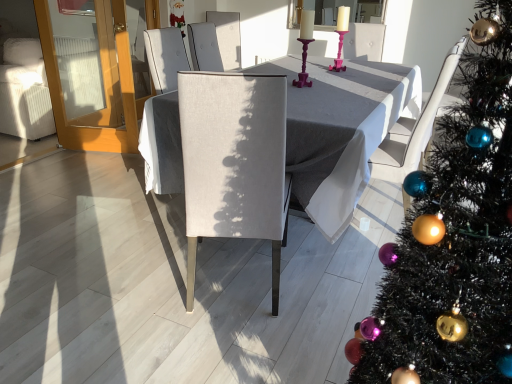
Describe the element at coordinates (339, 54) in the screenshot. This screenshot has width=512, height=384. I see `pink plastic candle holder at center` at that location.

At what (x,y) coordinates should I click in order to perform the action: click on shiny green christmas tree at right. Please return your answer as a coordinate pair (x, y). The image size is (512, 384). Looking at the image, I should click on (456, 238).

Image resolution: width=512 pixels, height=384 pixels. What do you see at coordinates (337, 11) in the screenshot?
I see `matte glass candlesticks at upper center` at bounding box center [337, 11].

Where is `matte glass candlesticks at upper center`? The height and width of the screenshot is (384, 512). matte glass candlesticks at upper center is located at coordinates (337, 11).

What do you see at coordinates (413, 129) in the screenshot?
I see `white fabric armchair at right` at bounding box center [413, 129].

Find the location of a particular element. This screenshot has height=384, width=512. pink plastic candle holder at center is located at coordinates (339, 54).

Is white fabric armchair at right touching matte glass candlesticks at upper center?

No, white fabric armchair at right is not touching matte glass candlesticks at upper center.

From a real-world perspective, is white fabric armchair at right under matte glass candlesticks at upper center?

Yes, from a real-world perspective, white fabric armchair at right is beneath matte glass candlesticks at upper center.

Which object is further away from the camera taking this photo, white fabric armchair at right or matte glass candlesticks at upper center?

Positioned behind is matte glass candlesticks at upper center.

Are pink plastic candle holder at center and matte gray table at center located far from each other?

No.

The image size is (512, 384). I want to click on candle holder behind the matte gray table at center, so click(339, 54).

Considering the sizes of objects pink plastic candle holder at center and matte gray table at center in the image provided, who is bigger, pink plastic candle holder at center or matte gray table at center?

Bigger between the two is matte gray table at center.

Is pink plastic candle holder at center in front of or behind matte gray table at center in the image?

pink plastic candle holder at center is behind matte gray table at center.

Is matte gray chair at center smaller than matte glass candlesticks at upper center?

Incorrect, matte gray chair at center is not smaller in size than matte glass candlesticks at upper center.

From the picture: From a real-world perspective, which object rests below the other?

From a 3D spatial view, matte gray chair at center is below.

Does point (211, 229) appear closer or farther from the camera than point (372, 3)?

Point (211, 229) appears to be closer to the viewer than point (372, 3).

Is matte gray chair at center facing away from matte glass candlesticks at upper center?

That's not correct — matte gray chair at center is not looking away from matte glass candlesticks at upper center.

From the image's perspective, between shiny green christmas tree at right and matte glass candlesticks at upper center, who is located below?

From the image's view, shiny green christmas tree at right is below.

Is shiny green christmas tree at right further to the viewer compared to matte glass candlesticks at upper center?

No, shiny green christmas tree at right is in front of matte glass candlesticks at upper center.

Considering the sizes of shiny green christmas tree at right and matte glass candlesticks at upper center in the image, is shiny green christmas tree at right bigger or smaller than matte glass candlesticks at upper center?

shiny green christmas tree at right is bigger than matte glass candlesticks at upper center.

Is shiny green christmas tree at right facing towards matte glass candlesticks at upper center?

No, shiny green christmas tree at right is not facing towards matte glass candlesticks at upper center.

Is pink plastic candle holder at center taller than matte gray chair at center?

Incorrect, the height of pink plastic candle holder at center is not larger of that of matte gray chair at center.

From the picture: Could you tell me if pink plastic candle holder at center is turned towards matte gray chair at center?

No.

Is pink plastic candle holder at center positioned far away from matte gray chair at center?

Yes, pink plastic candle holder at center and matte gray chair at center are located far from each other.

Is pink plastic candle holder at center to the left or to the right of matte gray chair at center in the image?

pink plastic candle holder at center is positioned on matte gray chair at center's right side.

Is shiny green christmas tree at right positioned far away from matte gray table at center?

shiny green christmas tree at right is far away from matte gray table at center.

What's the angular difference between shiny green christmas tree at right and matte gray table at center's facing directions?

There is a 0.0419-degree angle between the facing directions of shiny green christmas tree at right and matte gray table at center.

From a real-world perspective, between shiny green christmas tree at right and matte gray table at center, who is vertically lower?

matte gray table at center.

Can you confirm if shiny green christmas tree at right is wider than matte gray table at center?

Incorrect, the width of shiny green christmas tree at right does not surpass that of matte gray table at center.

Consider the image. Considering the positions of objects matte gray chair at center and matte gray table at center in the image provided, who is in front, matte gray chair at center or matte gray table at center?

Positioned in front is matte gray chair at center.

Looking at this image, is matte gray chair at center spatially inside matte gray table at center, or outside of it?

matte gray chair at center lies outside matte gray table at center.

Locate an element on the screen. chair to the left of matte gray table at center is located at coordinates (234, 162).

Considering the positions of points (195, 83) and (323, 90), is point (195, 83) farther from camera compared to point (323, 90)?

No, (195, 83) is in front of (323, 90).

You are a GUI agent. You are given a task and a screenshot of the screen. Output one action in this format:
    pyautogui.click(x=<x>, y=<y>)
    Task: Click on the window screen above the white fabric armchair at right (from the image's perspective)
    
    Given the screenshot: What is the action you would take?
    point(337,11)

In order to click on candle holder above the matte gray table at center (from a real-world perspective) in this screenshot , I will do `click(339, 54)`.

From the image, which object appears to be farther from matte glass candlesticks at upper center, shiny green christmas tree at right or matte gray chair at center?

The object further to matte glass candlesticks at upper center is shiny green christmas tree at right.

Looking at the image, which one is located closer to matte gray chair at center, white fabric armchair at right or matte glass candlesticks at upper center?

white fabric armchair at right is closer to matte gray chair at center.

When comparing their distances from white fabric armchair at right, does matte gray chair at center or matte glass candlesticks at upper center seem further?

matte glass candlesticks at upper center is further to white fabric armchair at right.

Considering their positions, is transparent glass door at left positioned closer to matte gray chair at center than pink plastic candle holder at center?

Answer: pink plastic candle holder at center is positioned closer to the anchor matte gray chair at center.

From the image, which object appears to be nearer to shiny green christmas tree at right, matte glass candlesticks at upper center or transparent glass door at left?

Among the two, transparent glass door at left is located nearer to shiny green christmas tree at right.

Which object lies further to the anchor point matte glass candlesticks at upper center, matte gray table at center or white fabric armchair at right?

white fabric armchair at right is positioned further to the anchor matte glass candlesticks at upper center.

Estimate the real-world distances between objects in this image. Which object is closer to matte gray chair at center, matte gray table at center or transparent glass door at left?

matte gray table at center is positioned closer to the anchor matte gray chair at center.

Considering their positions, is pink plastic candle holder at center positioned further to matte gray table at center than matte glass candlesticks at upper center?

Based on the image, matte glass candlesticks at upper center appears to be further to matte gray table at center.

Find the location of a particular element. The image size is (512, 384). candle holder situated between transparent glass door at left and white fabric armchair at right from left to right is located at coordinates (339, 54).

Image resolution: width=512 pixels, height=384 pixels. In order to click on chair between shiny green christmas tree at right and pink plastic candle holder at center from front to back in this screenshot , I will do `click(234, 162)`.

I want to click on table situated between transparent glass door at left and pink plastic candle holder at center from left to right, so click(343, 133).

This screenshot has height=384, width=512. I want to click on table located between matte gray chair at center and matte glass candlesticks at upper center in the depth direction, so click(x=343, y=133).